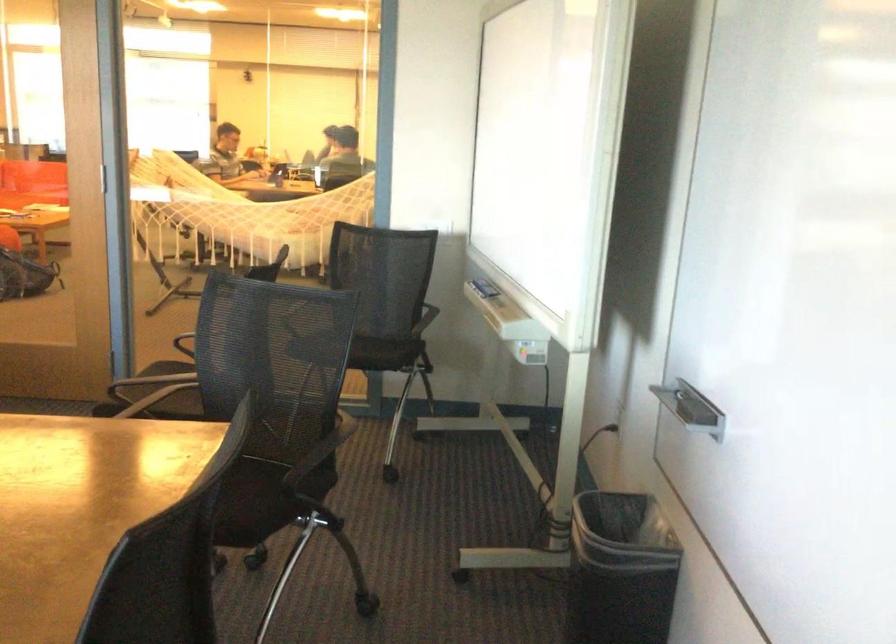
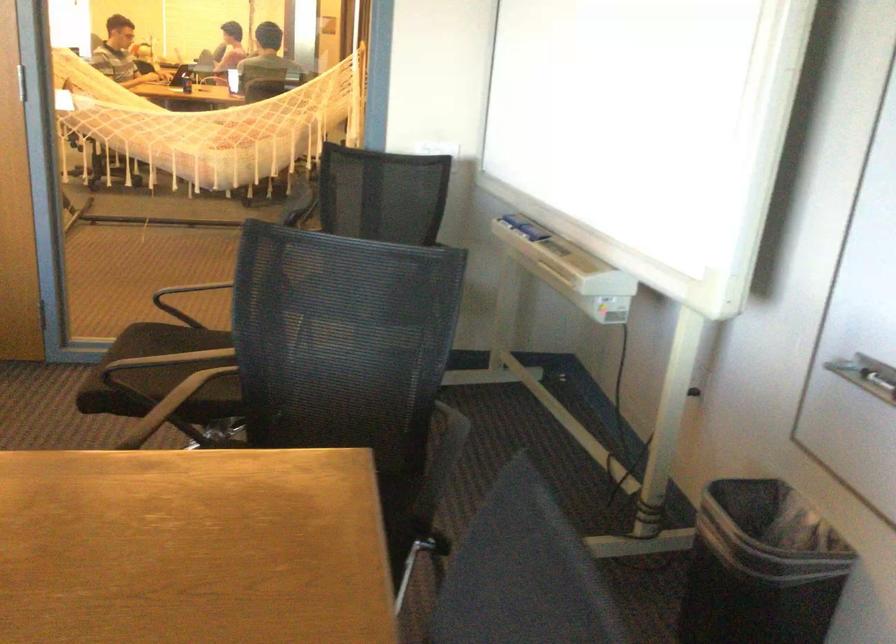
In a continuous first-person perspective shot, in which direction is the camera moving?

The cameraman walked toward left, forward.